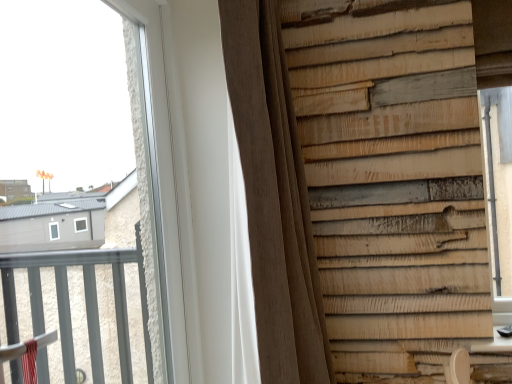
Question: From a real-world perspective, relative to transparent glass window at upper left, is brown textured curtain at center vertically above or below?

Choices:
 (A) above
 (B) below

Answer: (B)

Question: Considering the relative positions of brown textured curtain at center and transparent glass window at upper left in the image provided, is brown textured curtain at center to the left or to the right of transparent glass window at upper left?

Choices:
 (A) right
 (B) left

Answer: (A)

Question: From the image's perspective, is brown textured curtain at center above or below transparent glass window at upper left?

Choices:
 (A) below
 (B) above

Answer: (A)

Question: Looking at the image, does transparent glass window at upper left seem bigger or smaller compared to brown textured curtain at center?

Choices:
 (A) big
 (B) small

Answer: (B)

Question: From a real-world perspective, is transparent glass window at upper left positioned above or below brown textured curtain at center?

Choices:
 (A) above
 (B) below

Answer: (A)

Question: Is transparent glass window at upper left in front of or behind brown textured curtain at center in the image?

Choices:
 (A) behind
 (B) front

Answer: (B)

Question: Considering the relative positions of transparent glass window at upper left and brown textured curtain at center in the image provided, is transparent glass window at upper left to the left or to the right of brown textured curtain at center?

Choices:
 (A) right
 (B) left

Answer: (B)